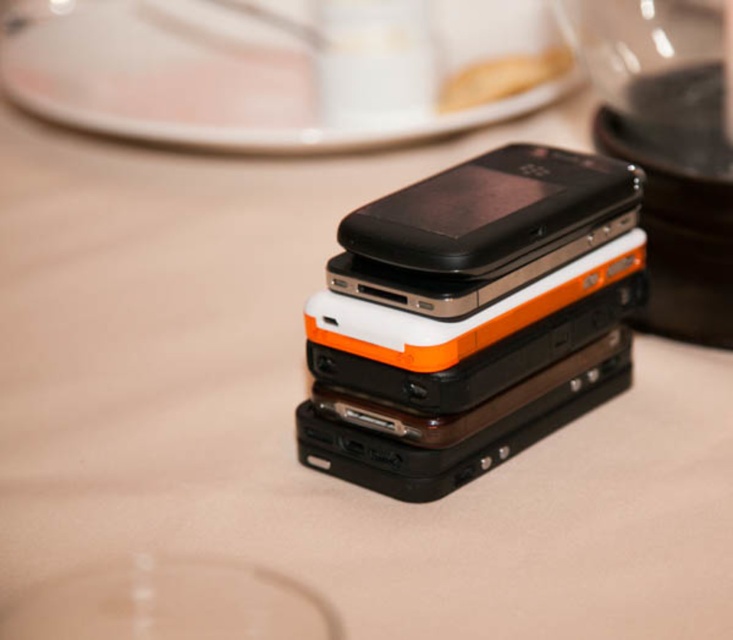
Does black plastic blender at upper right have a greater width compared to black matte smartphone at center?

No.

Locate an element on the screen. The height and width of the screenshot is (640, 733). black plastic blender at upper right is located at coordinates [668, 147].

Is white glossy plate at upper center thinner than black plastic blender at upper right?

No.

Who is higher up, white glossy plate at upper center or black plastic blender at upper right?

white glossy plate at upper center is higher up.

Describe the element at coordinates (199, 80) in the screenshot. I see `white glossy plate at upper center` at that location.

Where is `white glossy plate at upper center`? The height and width of the screenshot is (640, 733). white glossy plate at upper center is located at coordinates (199, 80).

Does white glossy plate at upper center appear on the left side of black matte smartphone at center?

Yes, white glossy plate at upper center is to the left of black matte smartphone at center.

Which is behind, point (78, 88) or point (563, 193)?

The point (78, 88) is behind.

The width and height of the screenshot is (733, 640). What do you see at coordinates (199, 80) in the screenshot?
I see `white glossy plate at upper center` at bounding box center [199, 80].

Identify the location of white glossy plate at upper center. (199, 80).